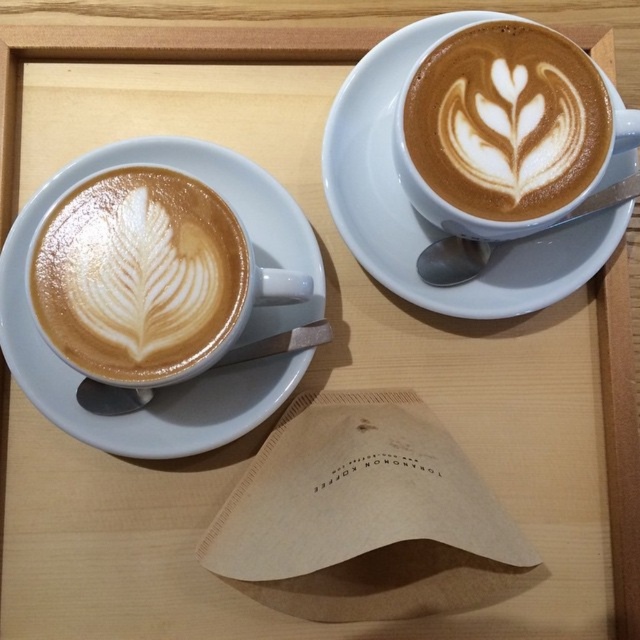
Question: Does matte white cup at left have a larger size compared to latte art at upper right?

Choices:
 (A) yes
 (B) no

Answer: (A)

Question: Does white ceramic saucer at lower left have a smaller size compared to latte art at upper right?

Choices:
 (A) yes
 (B) no

Answer: (B)

Question: Does white ceramic saucer at upper right appear on the left side of latte art at upper right?

Choices:
 (A) no
 (B) yes

Answer: (B)

Question: Based on their relative distances, which object is nearer to the latte art at upper right?

Choices:
 (A) white ceramic saucer at upper right
 (B) matte white cup at left

Answer: (A)

Question: Which object is positioned closest to the matte white cup at left?

Choices:
 (A) latte art at upper right
 (B) white ceramic saucer at lower left

Answer: (B)

Question: Considering the real-world distances, which object is closest to the matte white cup at left?

Choices:
 (A) white ceramic saucer at upper right
 (B) latte art at upper right

Answer: (A)